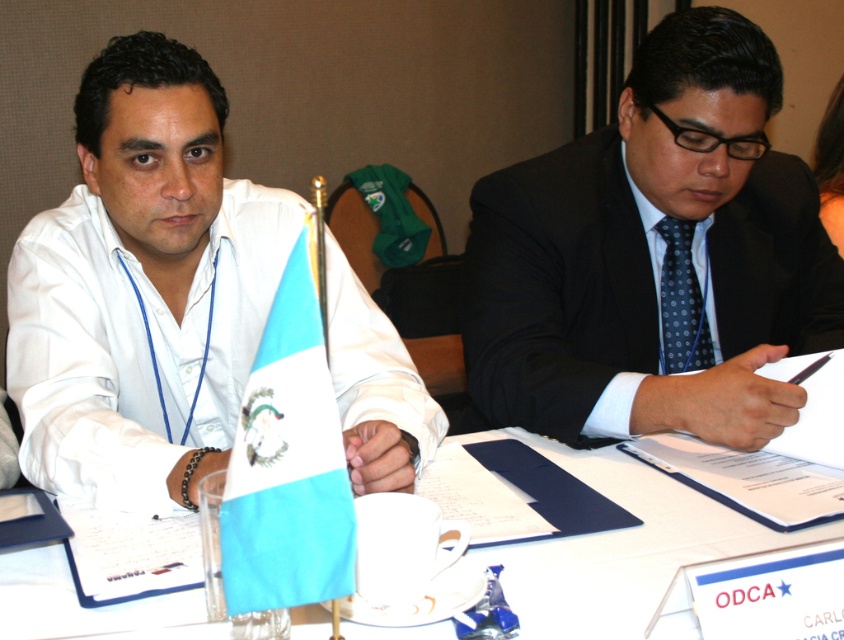
Does white paper at center lie behind blue dotted tie at center?

No, it is not.

Can you confirm if white paper at center is positioned above blue dotted tie at center?

No.

Measure the distance between point (58, 621) and camera.

Point (58, 621) is 78.03 centimeters from camera.

What are the coordinates of `white paper at center` in the screenshot? It's located at (620, 547).

Who is positioned more to the left, white paper at center or black hair at upper right?

white paper at center

Is white paper at center shorter than black hair at upper right?

Correct, white paper at center is not as tall as black hair at upper right.

Which is behind, point (658, 529) or point (825, 182)?

Positioned behind is point (825, 182).

Identify the location of white paper at center. This screenshot has height=640, width=844. (620, 547).

Does dark blue suit at center have a larger size compared to white matte shirt at left?

Indeed, dark blue suit at center has a larger size compared to white matte shirt at left.

Which of these two, dark blue suit at center or white matte shirt at left, stands taller?

dark blue suit at center

Who is more distant from viewer, (533, 406) or (154, 296)?

Positioned behind is point (533, 406).

This screenshot has height=640, width=844. I want to click on dark blue suit at center, so click(x=653, y=257).